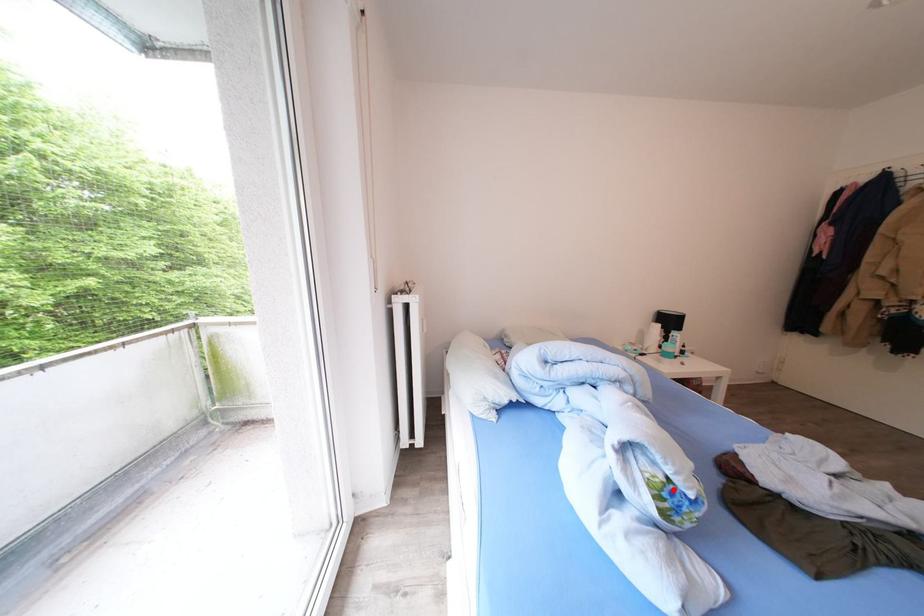
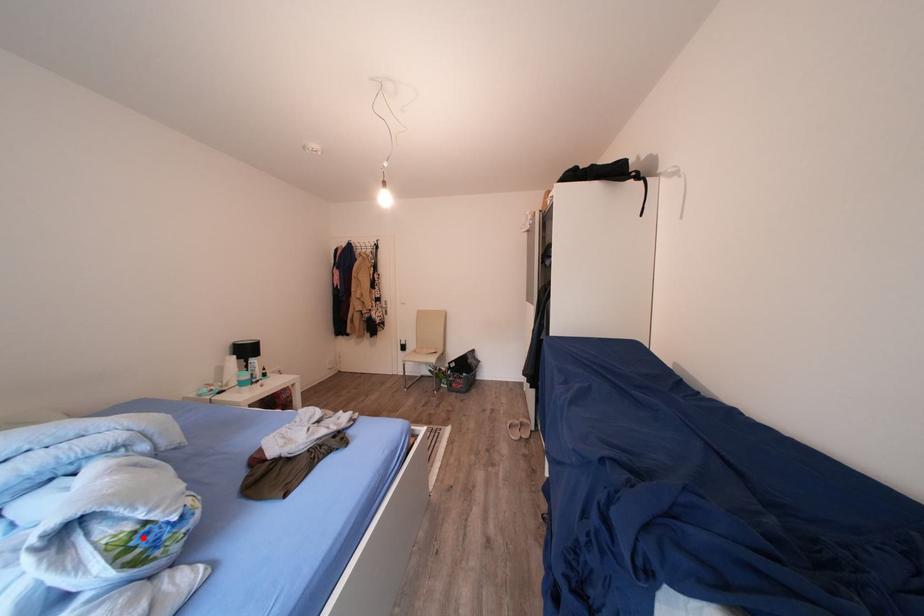
I am providing you with two images of the same scene from different viewpoints. A red point is marked on the first image and another point is marked on the second image. Does the point marked in image1 correspond to the same location as the one in image2?

Yes